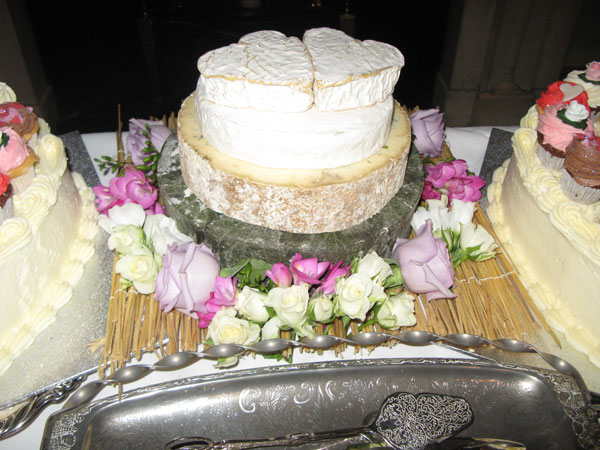
I want to click on tablecloth, so click(x=457, y=139).